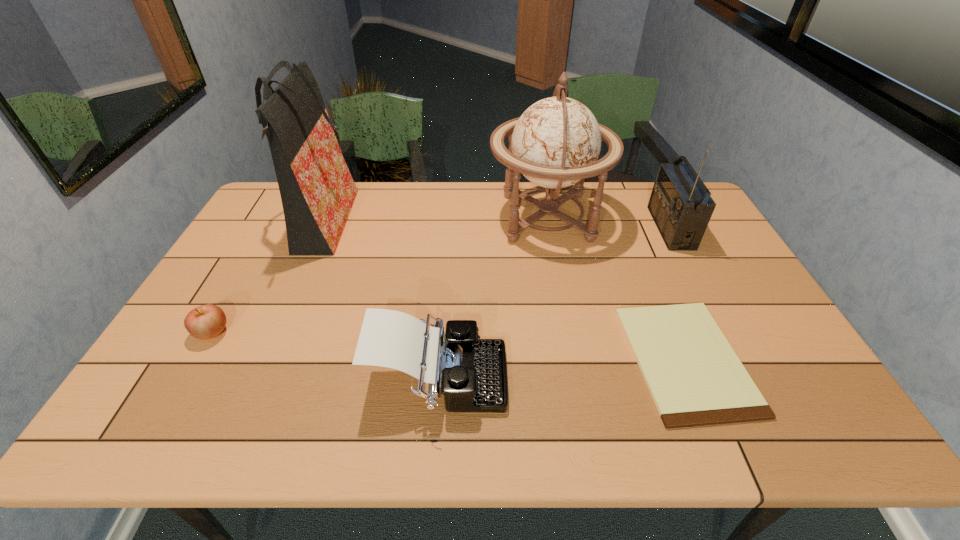
What are the coordinates of `typewriter positioned at the near edge` in the screenshot? It's located at (471, 372).

Locate an element on the screen. Image resolution: width=960 pixels, height=540 pixels. clipboard located in the near edge section of the desktop is located at coordinates (695, 378).

What are the coordinates of `shopping bag at the left edge` in the screenshot? It's located at (317, 191).

At what (x,y) coordinates should I click in order to perform the action: click on apple that is at the left edge. Please return your answer as a coordinate pair (x, y). The width and height of the screenshot is (960, 540). Looking at the image, I should click on (204, 322).

I want to click on radio receiver located at the right edge, so click(680, 204).

Locate an element on the screen. clipboard at the right edge is located at coordinates (695, 378).

Where is `object that is at the far left corner`? object that is at the far left corner is located at coordinates (317, 191).

The height and width of the screenshot is (540, 960). What are the coordinates of `object present at the far right corner` in the screenshot? It's located at (680, 204).

Locate an element on the screen. Image resolution: width=960 pixels, height=540 pixels. object that is at the near right corner is located at coordinates (695, 378).

In the image, there is a desktop. At what (x,y) coordinates should I click in order to perform the action: click on vacant space at the far edge. Please return your answer as a coordinate pair (x, y). The width and height of the screenshot is (960, 540). Looking at the image, I should click on (609, 197).